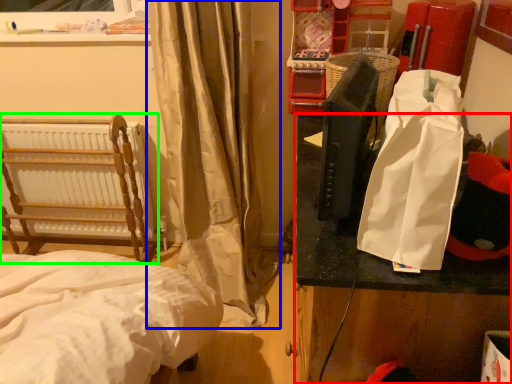
Question: Estimate the real-world distances between objects in this image. Which object is farther from table (highlighted by a red box), curtain (highlighted by a blue box) or furniture (highlighted by a green box)?

Choices:
 (A) curtain
 (B) furniture

Answer: (B)